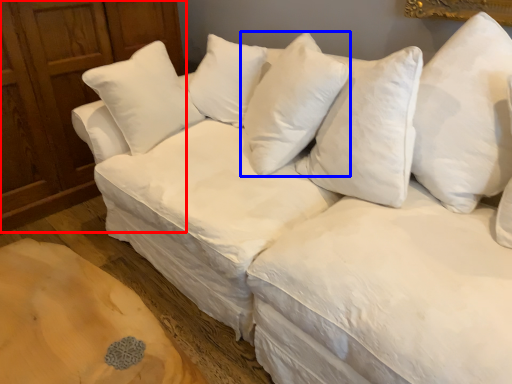
Question: Among these objects, which one is farthest to the camera, dresser (highlighted by a red box) or pillow (highlighted by a blue box)?

Choices:
 (A) dresser
 (B) pillow

Answer: (A)